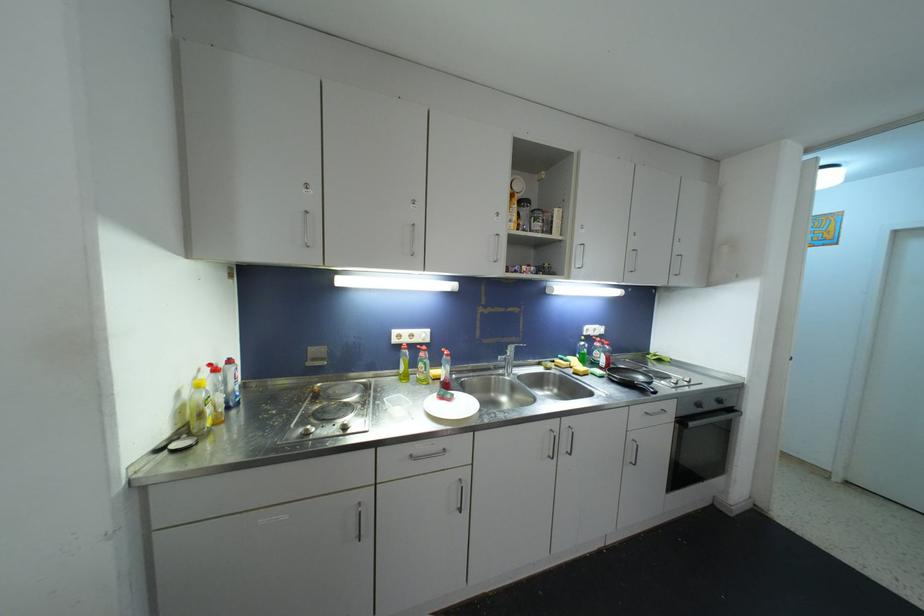
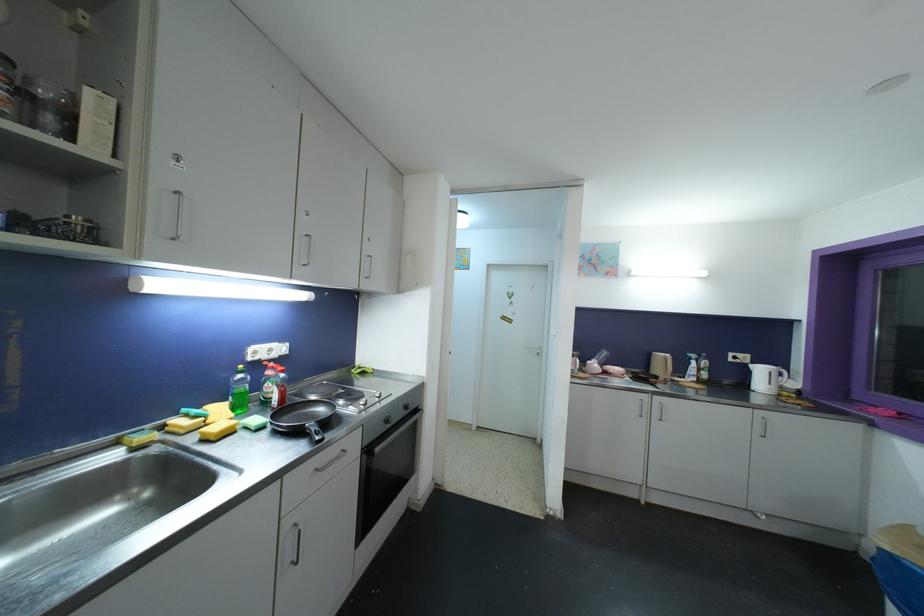
Question: How did the camera likely rotate?

Choices:
 (A) Left
 (B) Right
 (C) Up
 (D) Down

Answer: (B)